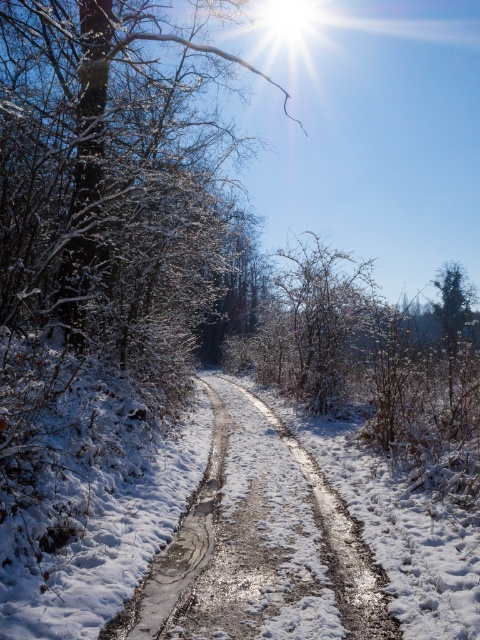
You are a hiker navigating through the forest and want to reach the tree at the top of the path. You see the white frosty tree at upper center and the slick mud track at center. Which one should you walk towards to get closer to the tree?

You should walk towards the slick mud track at center because the white frosty tree at upper center is further away from you than the track. The track is closer, so moving towards it will bring you nearer to the tree.

You are standing at the starting point of the snow path and want to reach the white frosty tree at upper center. According to the coordinates provided, what direction should you head towards from your current position?

The white frosty tree at upper center is located at coordinates point (108, 172), which means you should head towards the upper center direction from your current position to reach it.

Consider the image. You are an adventurer walking along the snow path and you see the white frosty tree at upper center and the slick mud track at center. Which object is located above the other?

The white frosty tree at upper center is positioned over slick mud track at center, so the white frosty tree at upper center is above the slick mud track at center.